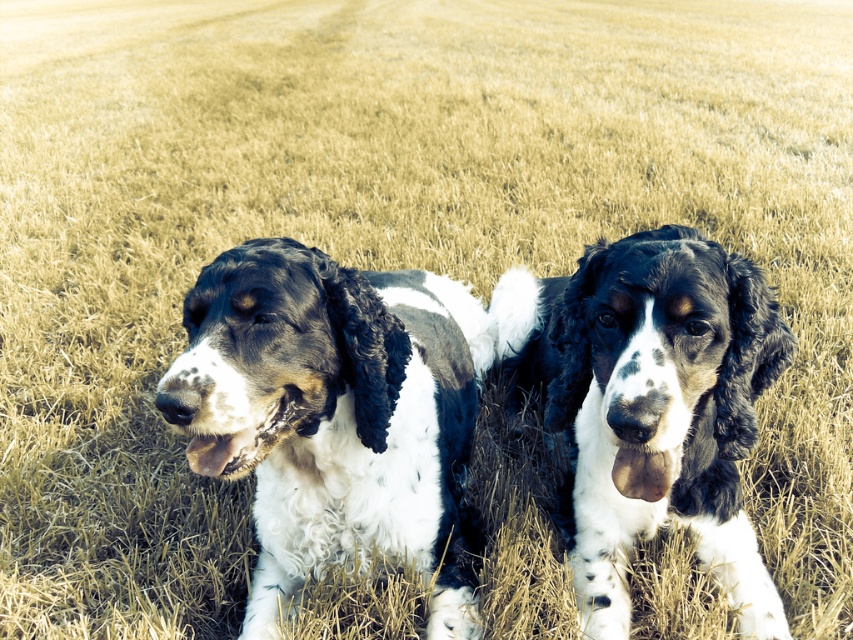
Question: Is black and white fur dog at center above spotted fur dog at center?

Choices:
 (A) no
 (B) yes

Answer: (A)

Question: Which point is farther to the camera?

Choices:
 (A) spotted fur dog at center
 (B) black and white fur dog at center

Answer: (A)

Question: Is black and white fur dog at center positioned in front of spotted fur dog at center?

Choices:
 (A) no
 (B) yes

Answer: (B)

Question: Among these points, which one is farthest from the camera?

Choices:
 (A) (721, 572)
 (B) (381, 401)

Answer: (A)

Question: Is black and white fur dog at center positioned behind spotted fur dog at center?

Choices:
 (A) no
 (B) yes

Answer: (A)